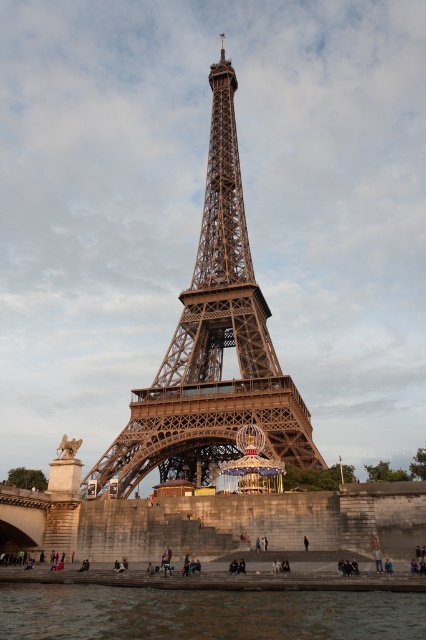
Does point (141, 420) come behind point (17, 627)?

Yes, it is behind point (17, 627).

Which is in front, point (147, 412) or point (284, 634)?

Point (284, 634)

Image resolution: width=426 pixels, height=640 pixels. In order to click on brown metal eiffel tower at center in this screenshot , I will do `click(213, 346)`.